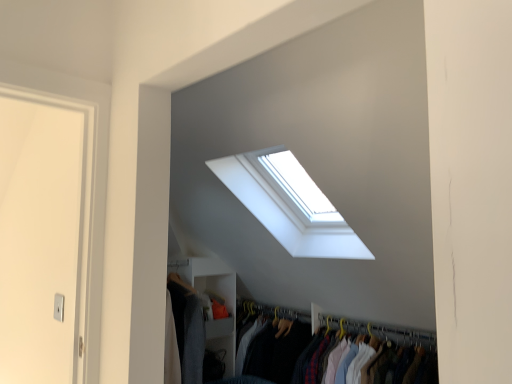
Question: Can you confirm if white fabric clothes at center, arranged as the second closet when viewed from the back, is bigger than white matte closet at lower left, the second closet from the front?

Choices:
 (A) no
 (B) yes

Answer: (B)

Question: From the image's perspective, is white fabric clothes at center, the second closet positioned from the left, located beneath white matte closet at lower left, the second closet from the front?

Choices:
 (A) yes
 (B) no

Answer: (A)

Question: Does white fabric clothes at center, the first closet from the right, touch white matte closet at lower left, which is counted as the second closet, starting from the right?

Choices:
 (A) yes
 (B) no

Answer: (B)

Question: Is white fabric clothes at center, the second closet positioned from the left, surrounding white matte closet at lower left, which is counted as the second closet, starting from the right?

Choices:
 (A) yes
 (B) no

Answer: (B)

Question: Is white fabric clothes at center, arranged as the second closet when viewed from the back, facing towards white matte closet at lower left, the first closet viewed from the left?

Choices:
 (A) no
 (B) yes

Answer: (A)

Question: Is white fabric clothes at center, arranged as the first closet when viewed from the front, in front of or behind white matte closet at lower left, the first closet viewed from the left, in the image?

Choices:
 (A) behind
 (B) front

Answer: (B)

Question: From a real-world perspective, is white fabric clothes at center, arranged as the second closet when viewed from the back, positioned above or below white matte closet at lower left, which is counted as the second closet, starting from the right?

Choices:
 (A) below
 (B) above

Answer: (A)

Question: Is point (338, 317) positioned closer to the camera than point (181, 266)?

Choices:
 (A) closer
 (B) farther

Answer: (A)

Question: Is white fabric clothes at center, the first closet from the right, wider or thinner than white matte closet at lower left, the second closet from the front?

Choices:
 (A) thin
 (B) wide

Answer: (B)

Question: Considering the positions of point (245, 190) and point (368, 329), is point (245, 190) closer or farther from the camera than point (368, 329)?

Choices:
 (A) closer
 (B) farther

Answer: (A)

Question: From a real-world perspective, is white glass window at upper center physically located above or below yellow plastic hanger at upper center?

Choices:
 (A) below
 (B) above

Answer: (B)

Question: Considering the positions of white glass window at upper center and yellow plastic hanger at upper center in the image, is white glass window at upper center wider or thinner than yellow plastic hanger at upper center?

Choices:
 (A) wide
 (B) thin

Answer: (A)

Question: Which is correct: white glass window at upper center is inside yellow plastic hanger at upper center, or outside of it?

Choices:
 (A) inside
 (B) outside

Answer: (B)

Question: From the image's perspective, relative to white fabric clothes at center, the second closet positioned from the left, is yellow plastic hanger at upper center above or below?

Choices:
 (A) above
 (B) below

Answer: (A)

Question: Is yellow plastic hanger at upper center to the left or to the right of white fabric clothes at center, the second closet positioned from the left, in the image?

Choices:
 (A) left
 (B) right

Answer: (B)